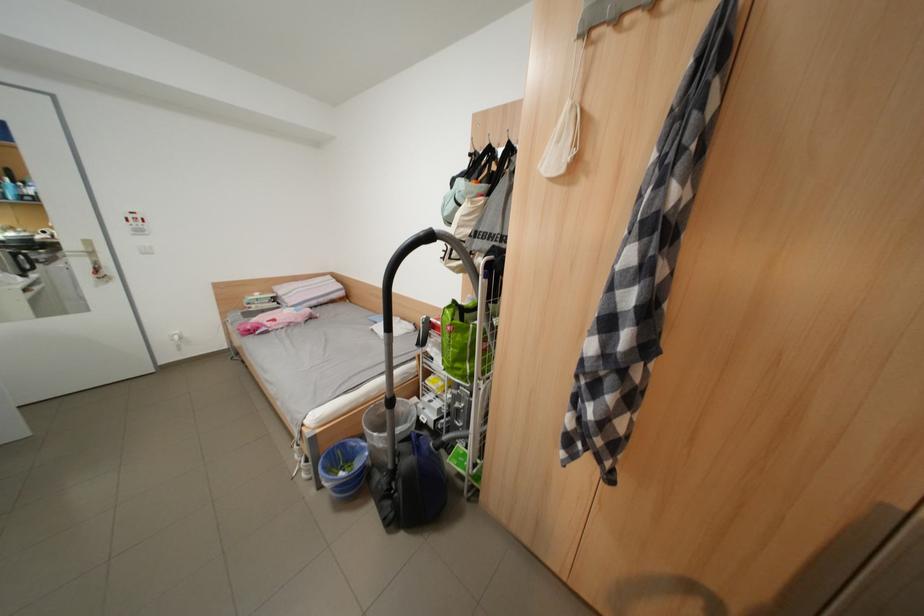
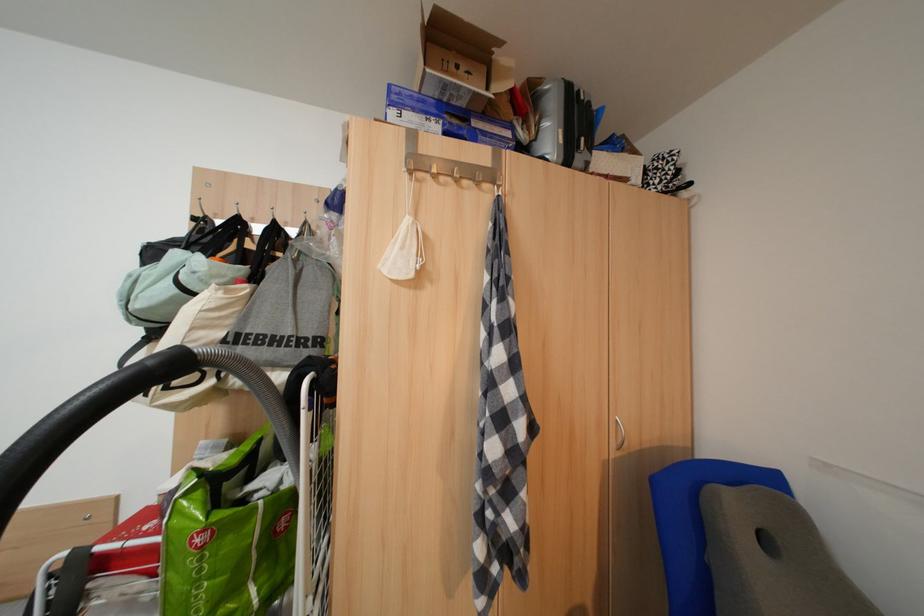
The point at [466,363] is marked in the first image. Where is the corresponding point in the second image?

(225, 610)